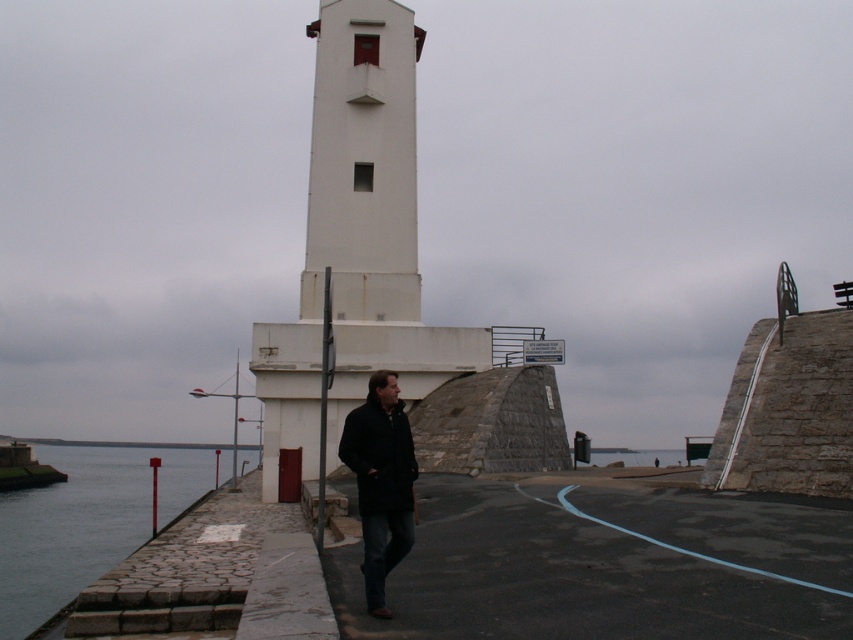
Which of these two, gray cobblestone water at lower left or black matte coat at center, stands shorter?

Standing shorter between the two is black matte coat at center.

Does gray cobblestone water at lower left appear under black matte coat at center?

Yes.

Find the location of a particular element. The image size is (853, 640). gray cobblestone water at lower left is located at coordinates (85, 522).

Locate an element on the screen. The width and height of the screenshot is (853, 640). gray cobblestone water at lower left is located at coordinates (85, 522).

Who is more distant from viewer, [270,464] or [312,211]?

The point [312,211] is more distant.

Can you confirm if white matte/lightweight tower at center is taller than white smooth tower at center?

Yes, white matte/lightweight tower at center is taller than white smooth tower at center.

The height and width of the screenshot is (640, 853). Identify the location of white matte/lightweight tower at center. (357, 243).

Between point (396, 305) and point (25, 554), which one is positioned behind?

Point (25, 554)

Is white smooth tower at center further to camera compared to gray cobblestone water at lower left?

Yes, white smooth tower at center is further from the viewer.

Is point (361, 104) positioned before point (175, 493)?

Yes, point (361, 104) is closer to viewer.

Locate an element on the screen. white smooth tower at center is located at coordinates (363, 163).